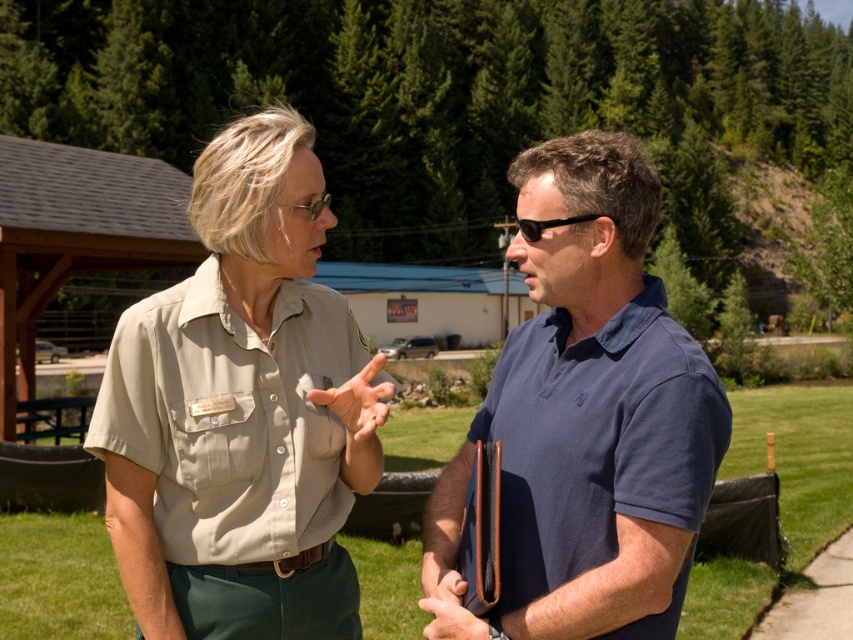
From the picture: Does beige uniform shirt at center have a lesser height compared to blue fabric shirt at center?

No.

Is point (697, 381) in front of point (585, 260)?

Yes.

Who is more distant from viewer, (552, 332) or (572, 163)?

Positioned behind is point (552, 332).

Locate an element on the screen. beige uniform shirt at center is located at coordinates (585, 419).

Does matte khaki shirt at center have a lesser height compared to blue fabric shirt at center?

No.

Does matte khaki shirt at center have a greater height compared to blue fabric shirt at center?

Indeed, matte khaki shirt at center has a greater height compared to blue fabric shirt at center.

Which is behind, point (117, 500) or point (668, 604)?

The point (117, 500) is more distant.

This screenshot has width=853, height=640. Find the location of `matte khaki shirt at center`. matte khaki shirt at center is located at coordinates (242, 410).

Is beige uniform shirt at center wider than matte khaki shirt at center?

Yes.

Which is in front, point (469, 616) or point (282, 618)?

Point (469, 616)

Where is `beige uniform shirt at center`? beige uniform shirt at center is located at coordinates (585, 419).